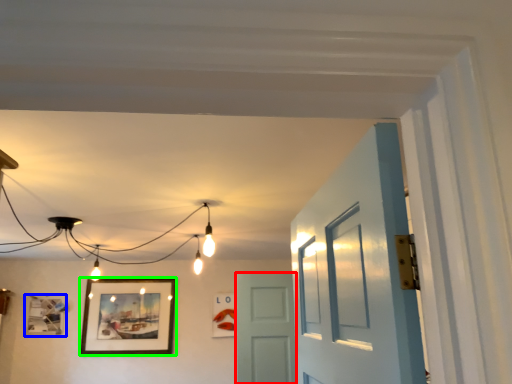
Question: Which object is positioned closest to door (highlighted by a red box)? Select from picture frame (highlighted by a blue box) and picture frame (highlighted by a green box).

Choices:
 (A) picture frame
 (B) picture frame

Answer: (B)